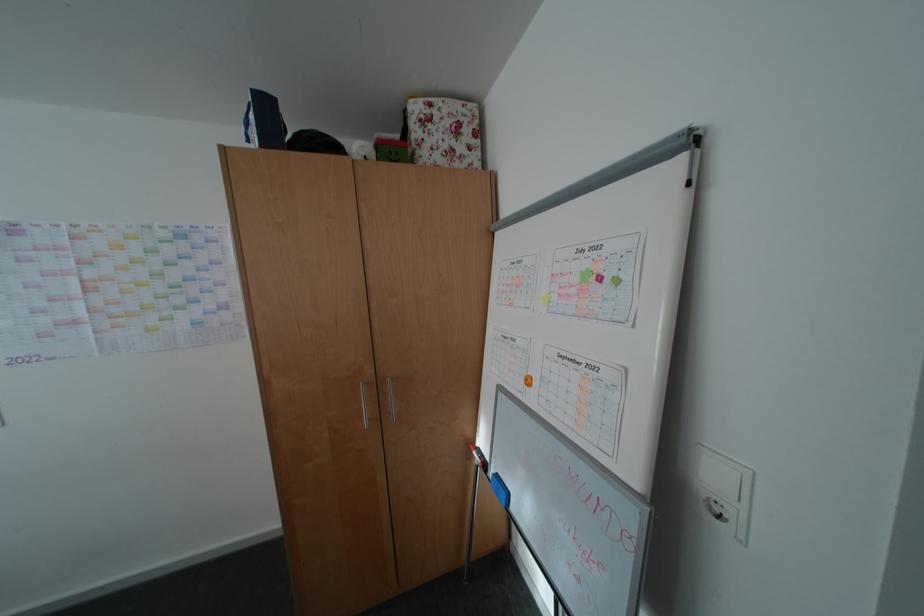
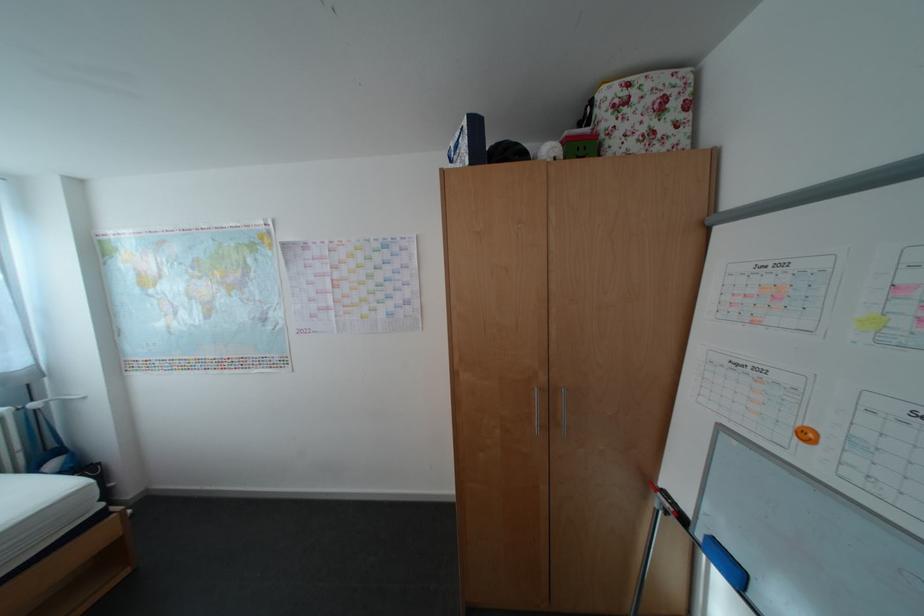
Locate, in the second image, the point that corresponds to the point at 385,150 in the first image.

(574, 148)